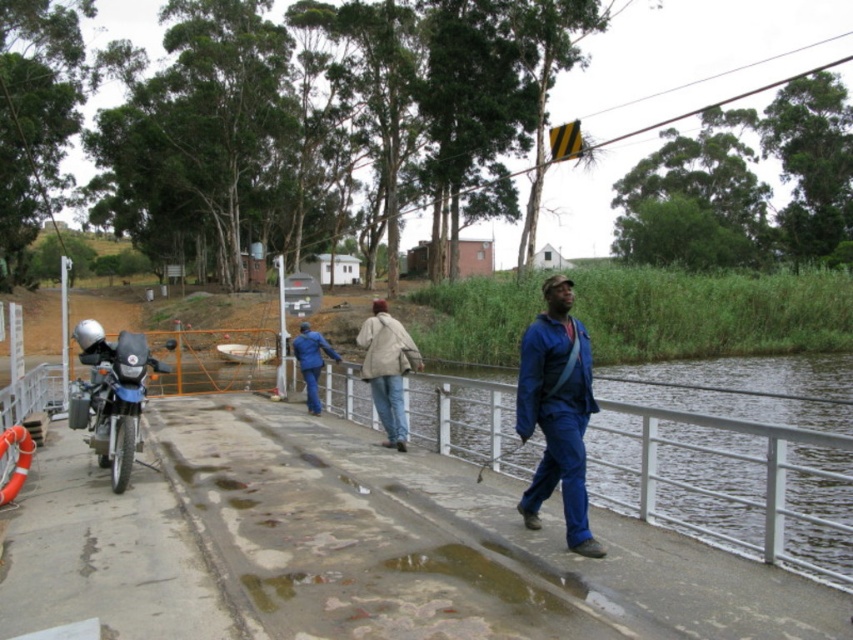
Question: Which point appears farthest from the camera in this image?

Choices:
 (A) (91, 330)
 (B) (389, 442)
 (C) (549, 278)

Answer: (B)

Question: Does blue matte jumpsuit at center have a greater width compared to blue fabric jacket at center?

Choices:
 (A) no
 (B) yes

Answer: (A)

Question: Based on their relative distances, which object is nearer to the matte black motorcycle at left?

Choices:
 (A) blue matte jumpsuit at center
 (B) beige fabric jacket at center

Answer: (A)

Question: Does blue matte jumpsuit at center have a lesser width compared to beige fabric jacket at center?

Choices:
 (A) yes
 (B) no

Answer: (A)

Question: Among these objects, which one is nearest to the camera?

Choices:
 (A) blue matte jumpsuit at center
 (B) beige fabric jacket at center
 (C) blue fabric jacket at center
 (D) matte black motorcycle at left

Answer: (A)

Question: In this image, where is blue matte jumpsuit at center located relative to matte black motorcycle at left?

Choices:
 (A) below
 (B) above

Answer: (A)